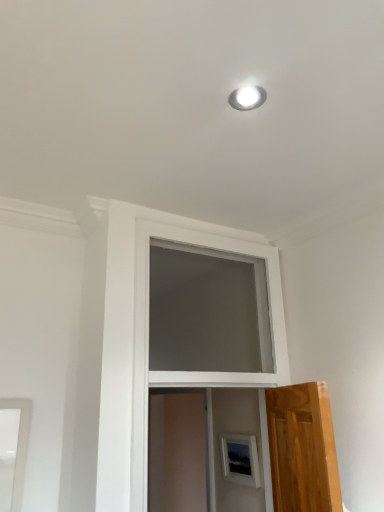
Question: Is white glossy light fixture at upper center closer to the viewer compared to translucent wood screen door at center?

Choices:
 (A) no
 (B) yes

Answer: (B)

Question: Can you confirm if white glossy light fixture at upper center is positioned to the right of translucent wood screen door at center?

Choices:
 (A) no
 (B) yes

Answer: (B)

Question: Can you confirm if white glossy light fixture at upper center is positioned to the left of translucent wood screen door at center?

Choices:
 (A) yes
 (B) no

Answer: (B)

Question: Is white glossy light fixture at upper center behind translucent wood screen door at center?

Choices:
 (A) no
 (B) yes

Answer: (A)

Question: Considering the relative sizes of white glossy light fixture at upper center and translucent wood screen door at center in the image provided, is white glossy light fixture at upper center bigger than translucent wood screen door at center?

Choices:
 (A) yes
 (B) no

Answer: (B)

Question: Could you tell me if white glossy light fixture at upper center is turned towards translucent wood screen door at center?

Choices:
 (A) no
 (B) yes

Answer: (A)

Question: Does translucent wood screen door at center appear on the right side of white glossy light fixture at upper center?

Choices:
 (A) no
 (B) yes

Answer: (A)

Question: Considering the relative positions of translucent wood screen door at center and white glossy light fixture at upper center in the image provided, is translucent wood screen door at center to the left of white glossy light fixture at upper center from the viewer's perspective?

Choices:
 (A) yes
 (B) no

Answer: (A)

Question: Is the position of translucent wood screen door at center less distant than that of white glossy light fixture at upper center?

Choices:
 (A) no
 (B) yes

Answer: (A)

Question: Does translucent wood screen door at center have a lesser width compared to white glossy light fixture at upper center?

Choices:
 (A) no
 (B) yes

Answer: (A)

Question: Does translucent wood screen door at center have a larger size compared to white glossy light fixture at upper center?

Choices:
 (A) yes
 (B) no

Answer: (A)

Question: Could white glossy light fixture at upper center be considered to be inside translucent wood screen door at center?

Choices:
 (A) yes
 (B) no

Answer: (B)

Question: Considering the positions of white glossy light fixture at upper center and translucent wood screen door at center in the image, is white glossy light fixture at upper center taller or shorter than translucent wood screen door at center?

Choices:
 (A) short
 (B) tall

Answer: (A)